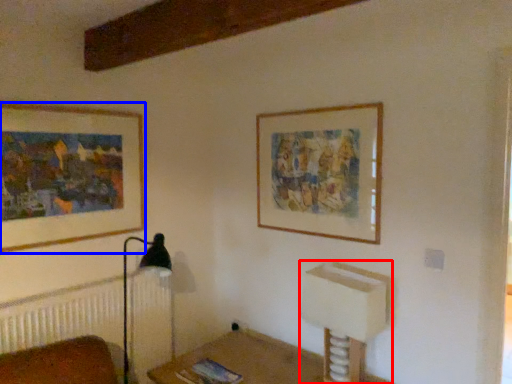
Question: Which point is closer to the camera, vanity (highlighted by a red box) or picture frame (highlighted by a blue box)?

Choices:
 (A) vanity
 (B) picture frame

Answer: (A)